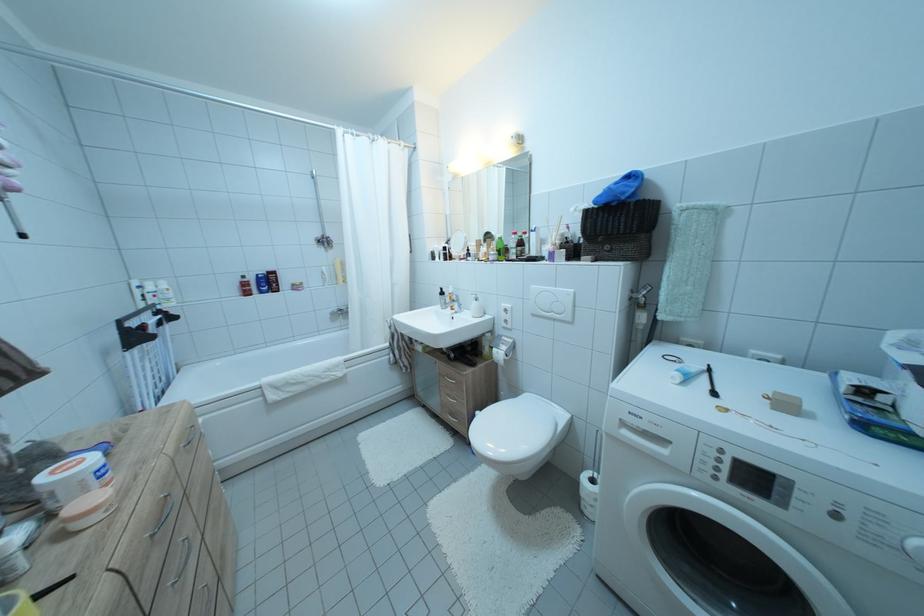
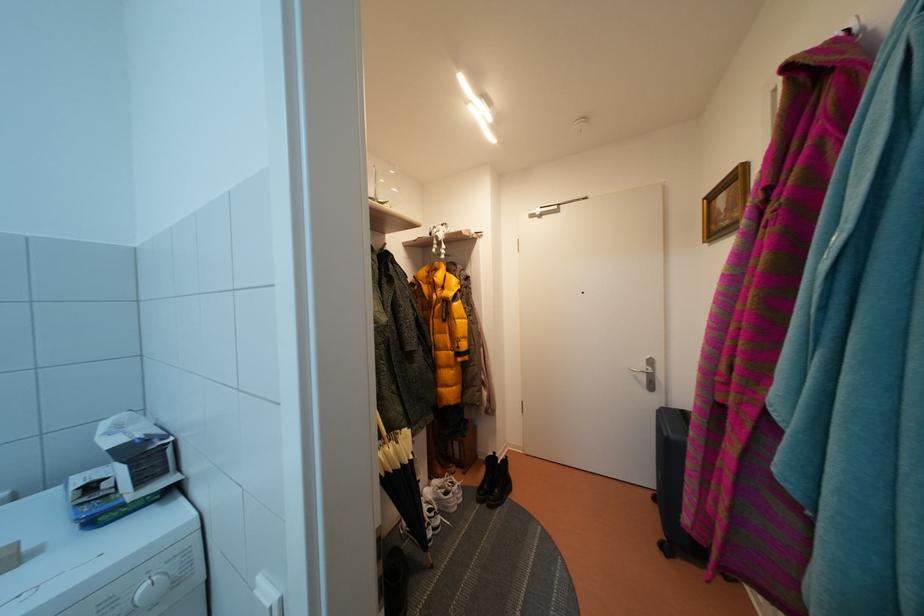
Question: The images are taken continuously from a first-person perspective. In which direction is your viewpoint rotating?

Choices:
 (A) Left
 (B) Right
 (C) Up
 (D) Down

Answer: (B)